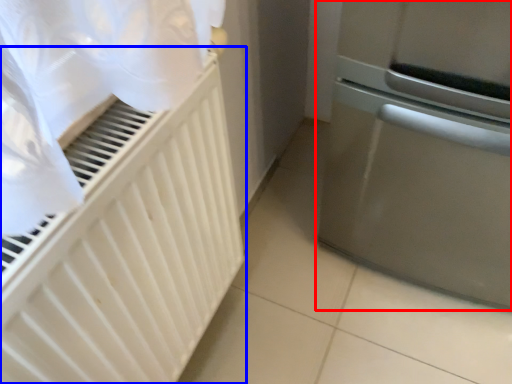
Question: Which object appears farthest to the camera in this image, home appliance (highlighted by a red box) or radiator (highlighted by a blue box)?

Choices:
 (A) home appliance
 (B) radiator

Answer: (A)